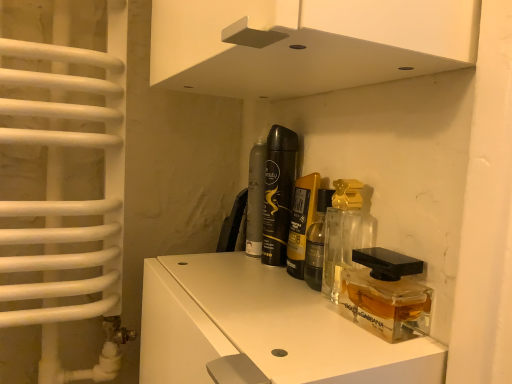
Describe the element at coordinates (301, 222) in the screenshot. I see `clear glass perfume at center, placed as the 3th perfume when sorted from back to front` at that location.

What do you see at coordinates (278, 193) in the screenshot?
I see `translucent glass perfume at center, placed as the third perfume when sorted from front to back` at bounding box center [278, 193].

Where is `translucent glass perfume at center, the 2th perfume when ordered from back to front`? The width and height of the screenshot is (512, 384). translucent glass perfume at center, the 2th perfume when ordered from back to front is located at coordinates (278, 193).

Describe the element at coordinates (262, 328) in the screenshot. I see `transparent glass perfume bottles at center` at that location.

I want to click on transparent plastic perfume bottle at center, so click(385, 294).

Is clear glass perfume at center, the 4th perfume viewed from the back, oriented away from translucent glass perfume at center, placed as the third perfume when sorted from front to back?

No, clear glass perfume at center, the 4th perfume viewed from the back,'s orientation is not away from translucent glass perfume at center, placed as the third perfume when sorted from front to back.

What's the angular difference between clear glass perfume at center, the 4th perfume viewed from the back, and translucent glass perfume at center, placed as the third perfume when sorted from front to back,'s facing directions?

The facing directions of clear glass perfume at center, the 4th perfume viewed from the back, and translucent glass perfume at center, placed as the third perfume when sorted from front to back, are 0.803 degrees apart.

From the image's perspective, relative to translucent glass perfume at center, the 2th perfume when ordered from back to front, is clear glass perfume at center, which ranks as the 1th perfume in front-to-back order, above or below?

Based on their image positions, clear glass perfume at center, which ranks as the 1th perfume in front-to-back order, is located beneath translucent glass perfume at center, the 2th perfume when ordered from back to front.

Is transparent plastic perfume bottle at center inside clear glass perfume at center, the second perfume when ordered from front to back?

No, transparent plastic perfume bottle at center is not a part of clear glass perfume at center, the second perfume when ordered from front to back.

Who is more distant, clear glass perfume at center, the second perfume when ordered from front to back, or transparent plastic perfume bottle at center?

clear glass perfume at center, the second perfume when ordered from front to back.

From the image's perspective, starting from the transparent plastic perfume bottle at center, which perfume is the 2nd one above? Please provide its 2D coordinates.

[(301, 222)]

Considering the points (317, 176) and (406, 292), which point is in front, point (317, 176) or point (406, 292)?

The point (406, 292) is closer to the camera.

Is transparent glass perfume bottles at center at the back of translucent glass perfume at center, the 2th perfume when ordered from back to front?

translucent glass perfume at center, the 2th perfume when ordered from back to front, is not turned away from transparent glass perfume bottles at center.

In terms of width, does translucent glass perfume at center, the 2th perfume when ordered from back to front, look wider or thinner when compared to transparent glass perfume bottles at center?

In the image, translucent glass perfume at center, the 2th perfume when ordered from back to front, appears to be more narrow than transparent glass perfume bottles at center.

Is translucent glass perfume at center, the 2th perfume when ordered from back to front, at the right side of transparent glass perfume bottles at center?

Correct, you'll find translucent glass perfume at center, the 2th perfume when ordered from back to front, to the right of transparent glass perfume bottles at center.

Which is in front, point (276, 148) or point (434, 370)?

The point (434, 370) is in front.

Which object is positioned more to the left, clear glass perfume at center, the 4th perfume viewed from the back, or transparent plastic perfume bottle at center?

clear glass perfume at center, the 4th perfume viewed from the back, is more to the left.

Considering the sizes of objects clear glass perfume at center, the 4th perfume viewed from the back, and transparent plastic perfume bottle at center in the image provided, who is wider, clear glass perfume at center, the 4th perfume viewed from the back, or transparent plastic perfume bottle at center?

Wider between the two is clear glass perfume at center, the 4th perfume viewed from the back.

Which point is more distant from viewer, (337, 249) or (397, 268)?

Positioned behind is point (337, 249).

Does point (255, 233) appear closer or farther from the camera than point (292, 261)?

Clearly, point (255, 233) is more distant from the camera than point (292, 261).

In terms of height, does matte black perfume at center, positioned as the 1th perfume in back-to-front order, look taller or shorter compared to clear glass perfume at center, placed as the 3th perfume when sorted from back to front?

Considering their sizes, matte black perfume at center, positioned as the 1th perfume in back-to-front order, has more height than clear glass perfume at center, placed as the 3th perfume when sorted from back to front.

Is matte black perfume at center, positioned as the 1th perfume in back-to-front order, next to clear glass perfume at center, the second perfume when ordered from front to back, and touching it?

Yes, matte black perfume at center, positioned as the 1th perfume in back-to-front order, is with clear glass perfume at center, the second perfume when ordered from front to back.

How distant is matte black perfume at center, positioned as the 1th perfume in back-to-front order, from clear glass perfume at center, placed as the 3th perfume when sorted from back to front?

matte black perfume at center, positioned as the 1th perfume in back-to-front order, is 9.31 centimeters away from clear glass perfume at center, placed as the 3th perfume when sorted from back to front.

Is matte black perfume at center, positioned as the 1th perfume in back-to-front order, positioned far away from transparent plastic perfume bottle at center?

matte black perfume at center, positioned as the 1th perfume in back-to-front order, is near transparent plastic perfume bottle at center, not far away.

Does matte black perfume at center, positioned as the 1th perfume in back-to-front order, have a greater height compared to transparent plastic perfume bottle at center?

Correct, matte black perfume at center, positioned as the 1th perfume in back-to-front order, is much taller as transparent plastic perfume bottle at center.

Is point (262, 196) in front of point (349, 312)?

No, (262, 196) is further to viewer.

From the image's perspective, which perfume is the 3rd one above the transparent plastic perfume bottle at center? Please provide its 2D coordinates.

[(255, 200)]

Does translucent glass perfume at center, placed as the third perfume when sorted from front to back, appear on the right side of matte black perfume at center, the fourth perfume when ordered from front to back?

Correct, you'll find translucent glass perfume at center, placed as the third perfume when sorted from front to back, to the right of matte black perfume at center, the fourth perfume when ordered from front to back.

Does translucent glass perfume at center, placed as the third perfume when sorted from front to back, have a greater height compared to matte black perfume at center, positioned as the 1th perfume in back-to-front order?

Indeed, translucent glass perfume at center, placed as the third perfume when sorted from front to back, has a greater height compared to matte black perfume at center, positioned as the 1th perfume in back-to-front order.

From the image's perspective, which one is positioned lower, translucent glass perfume at center, placed as the third perfume when sorted from front to back, or matte black perfume at center, the fourth perfume when ordered from front to back?

matte black perfume at center, the fourth perfume when ordered from front to back, is shown below in the image.

Does translucent glass perfume at center, placed as the third perfume when sorted from front to back, have a lesser width compared to matte black perfume at center, the fourth perfume when ordered from front to back?

Indeed, translucent glass perfume at center, placed as the third perfume when sorted from front to back, has a lesser width compared to matte black perfume at center, the fourth perfume when ordered from front to back.

Identify the location of the 3rd perfume above the clear glass perfume at center, the 4th perfume viewed from the back (from the image's perspective). Image resolution: width=512 pixels, height=384 pixels. (278, 193).

This screenshot has height=384, width=512. I want to click on product that is on the right side of clear glass perfume at center, the second perfume when ordered from front to back, so click(385, 294).

Estimate the real-world distances between objects in this image. Which object is closer to translucent glass perfume at center, the 2th perfume when ordered from back to front, clear glass perfume at center, placed as the 3th perfume when sorted from back to front, or matte black perfume at center, positioned as the 1th perfume in back-to-front order?

Based on the image, clear glass perfume at center, placed as the 3th perfume when sorted from back to front, appears to be nearer to translucent glass perfume at center, the 2th perfume when ordered from back to front.

When comparing their distances from transparent glass perfume bottles at center, does matte black perfume at center, positioned as the 1th perfume in back-to-front order, or clear glass perfume at center, which ranks as the 1th perfume in front-to-back order, seem further?

matte black perfume at center, positioned as the 1th perfume in back-to-front order, is positioned further to the anchor transparent glass perfume bottles at center.

Looking at the image, which one is located further to clear glass perfume at center, the 4th perfume viewed from the back, clear glass perfume at center, the second perfume when ordered from front to back, or matte black perfume at center, the fourth perfume when ordered from front to back?

matte black perfume at center, the fourth perfume when ordered from front to back, lies further to clear glass perfume at center, the 4th perfume viewed from the back, than the other object.

Estimate the real-world distances between objects in this image. Which object is further from transparent plastic perfume bottle at center, translucent glass perfume at center, the 2th perfume when ordered from back to front, or clear glass perfume at center, the second perfume when ordered from front to back?

translucent glass perfume at center, the 2th perfume when ordered from back to front, is further to transparent plastic perfume bottle at center.

Looking at the image, which one is located closer to clear glass perfume at center, the 4th perfume viewed from the back, transparent plastic perfume bottle at center or translucent glass perfume at center, the 2th perfume when ordered from back to front?

transparent plastic perfume bottle at center is closer to clear glass perfume at center, the 4th perfume viewed from the back.

Estimate the real-world distances between objects in this image. Which object is further from transparent plastic perfume bottle at center, clear glass perfume at center, placed as the 3th perfume when sorted from back to front, or clear glass perfume at center, the 4th perfume viewed from the back?

Among the two, clear glass perfume at center, placed as the 3th perfume when sorted from back to front, is located further to transparent plastic perfume bottle at center.

From the image, which object appears to be farther from transparent glass perfume bottles at center, clear glass perfume at center, the second perfume when ordered from front to back, or clear glass perfume at center, which ranks as the 1th perfume in front-to-back order?

clear glass perfume at center, the second perfume when ordered from front to back, lies further to transparent glass perfume bottles at center than the other object.

In the scene shown: When comparing their distances from translucent glass perfume at center, placed as the third perfume when sorted from front to back, does clear glass perfume at center, the 4th perfume viewed from the back, or matte black perfume at center, the fourth perfume when ordered from front to back, seem closer?

Among the two, matte black perfume at center, the fourth perfume when ordered from front to back, is located nearer to translucent glass perfume at center, placed as the third perfume when sorted from front to back.

This screenshot has height=384, width=512. I want to click on perfume between clear glass perfume at center, the 4th perfume viewed from the back, and translucent glass perfume at center, placed as the third perfume when sorted from front to back, from front to back, so click(301, 222).

This screenshot has width=512, height=384. Identify the location of product between transparent glass perfume bottles at center and translucent glass perfume at center, placed as the third perfume when sorted from front to back, in the front-back direction. (385, 294).

Image resolution: width=512 pixels, height=384 pixels. What are the coordinates of `perfume between transparent plastic perfume bottle at center and clear glass perfume at center, placed as the 3th perfume when sorted from back to front, in the front-back direction` in the screenshot? It's located at (345, 232).

The image size is (512, 384). Find the location of `product located between transparent glass perfume bottles at center and matte black perfume at center, positioned as the 1th perfume in back-to-front order, in the depth direction`. product located between transparent glass perfume bottles at center and matte black perfume at center, positioned as the 1th perfume in back-to-front order, in the depth direction is located at coordinates (385, 294).